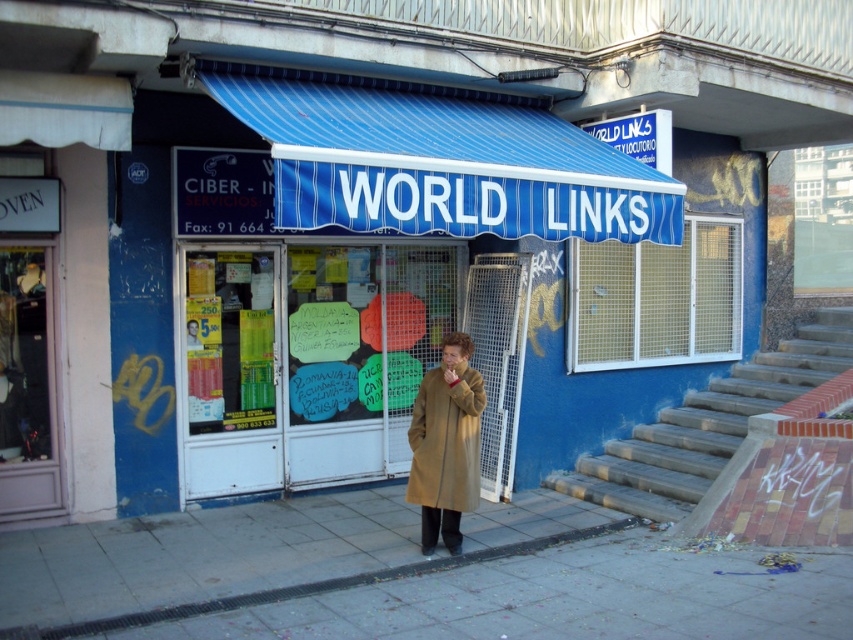
How distant is smooth concrete pavement at center from beige wool coat at center?

smooth concrete pavement at center is 38.47 inches away from beige wool coat at center.

Can you confirm if smooth concrete pavement at center is positioned to the left of beige wool coat at center?

Indeed, smooth concrete pavement at center is positioned on the left side of beige wool coat at center.

Is point (370, 595) less distant than point (445, 388)?

Yes, point (370, 595) is closer to viewer.

At what (x,y) coordinates should I click in order to perform the action: click on smooth concrete pavement at center. Please return your answer as a coordinate pair (x, y). Looking at the image, I should click on [x=404, y=577].